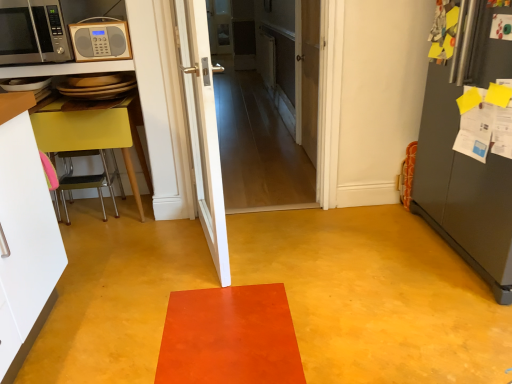
Question: Would you consider white glossy door at center, acting as the third door starting from the back, to be distant from wooden door at center, marked as the third door in a front-to-back arrangement?

Choices:
 (A) no
 (B) yes

Answer: (B)

Question: Is white glossy door at center, which appears as the first door when viewed from the front, in contact with wooden door at center, marked as the third door in a front-to-back arrangement?

Choices:
 (A) yes
 (B) no

Answer: (B)

Question: Does white glossy door at center, acting as the third door starting from the back, appear on the right side of wooden door at center, which is the first door in back-to-front order?

Choices:
 (A) no
 (B) yes

Answer: (A)

Question: Is white glossy door at center, which appears as the first door when viewed from the front, wider than wooden door at center, marked as the third door in a front-to-back arrangement?

Choices:
 (A) yes
 (B) no

Answer: (A)

Question: From a real-world perspective, is white glossy door at center, which appears as the first door when viewed from the front, on wooden door at center, which is the first door in back-to-front order?

Choices:
 (A) no
 (B) yes

Answer: (B)

Question: In the image, is white glossy door at center, acting as the third door starting from the back, on the left side or the right side of wooden door at center, marked as the third door in a front-to-back arrangement?

Choices:
 (A) left
 (B) right

Answer: (A)

Question: Looking at the image, does white glossy door at center, which appears as the first door when viewed from the front, seem bigger or smaller compared to wooden door at center, marked as the third door in a front-to-back arrangement?

Choices:
 (A) small
 (B) big

Answer: (B)

Question: From a real-world perspective, is white glossy door at center, acting as the third door starting from the back, above or below wooden door at center, marked as the third door in a front-to-back arrangement?

Choices:
 (A) above
 (B) below

Answer: (A)

Question: Is white glossy door at center, acting as the third door starting from the back, inside the boundaries of wooden door at center, which is the first door in back-to-front order, or outside?

Choices:
 (A) inside
 (B) outside

Answer: (B)

Question: Is white wooden door at center, the 2th door positioned from the front, taller or shorter than wooden door at center, marked as the third door in a front-to-back arrangement?

Choices:
 (A) short
 (B) tall

Answer: (A)

Question: Is point (315, 132) positioned closer to the camera than point (310, 142)?

Choices:
 (A) farther
 (B) closer

Answer: (B)

Question: Is white wooden door at center, the 2th door positioned from the front, to the left or to the right of wooden door at center, marked as the third door in a front-to-back arrangement, in the image?

Choices:
 (A) right
 (B) left

Answer: (B)

Question: From the image's perspective, relative to wooden door at center, marked as the third door in a front-to-back arrangement, is white wooden door at center, the 2th door positioned from the front, above or below?

Choices:
 (A) above
 (B) below

Answer: (B)

Question: Choose the correct answer: Is yellow matte table at left inside white wooden door at center, the 2th door positioned from the front, or outside it?

Choices:
 (A) outside
 (B) inside

Answer: (A)

Question: In the image, is yellow matte table at left positioned in front of or behind white wooden door at center, the 2th door positioned from the front?

Choices:
 (A) behind
 (B) front

Answer: (A)